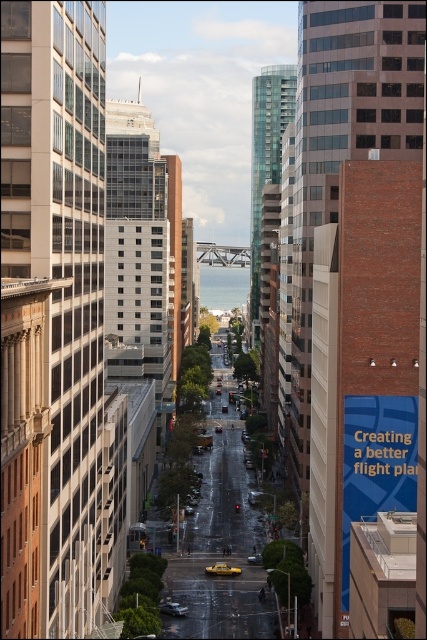
From the picture: Who is positioned more to the right, yellow rubber taxi at center or metallic silver sedan at center?

From the viewer's perspective, yellow rubber taxi at center appears more on the right side.

Is yellow rubber taxi at center smaller than metallic silver sedan at center?

Yes.

The image size is (427, 640). I want to click on yellow rubber taxi at center, so (x=222, y=570).